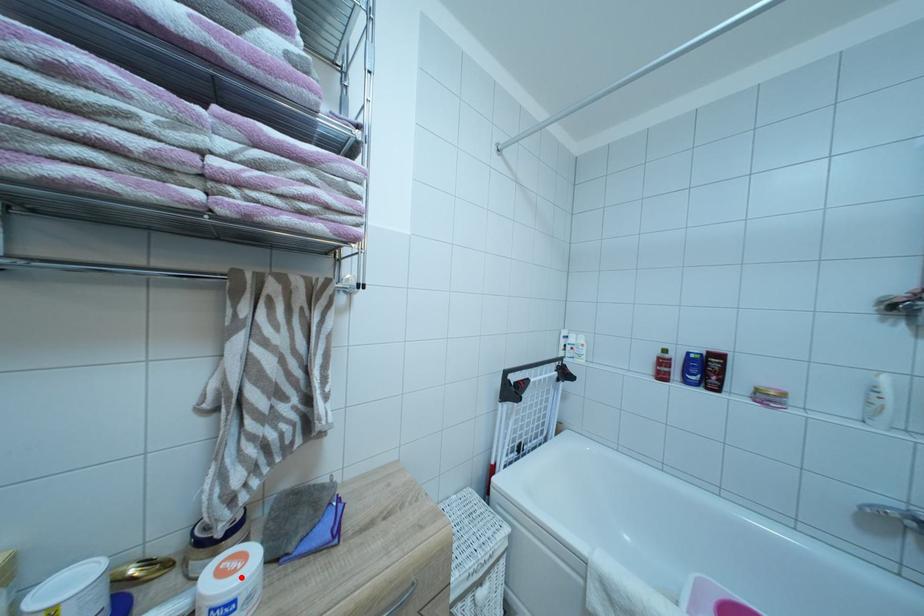
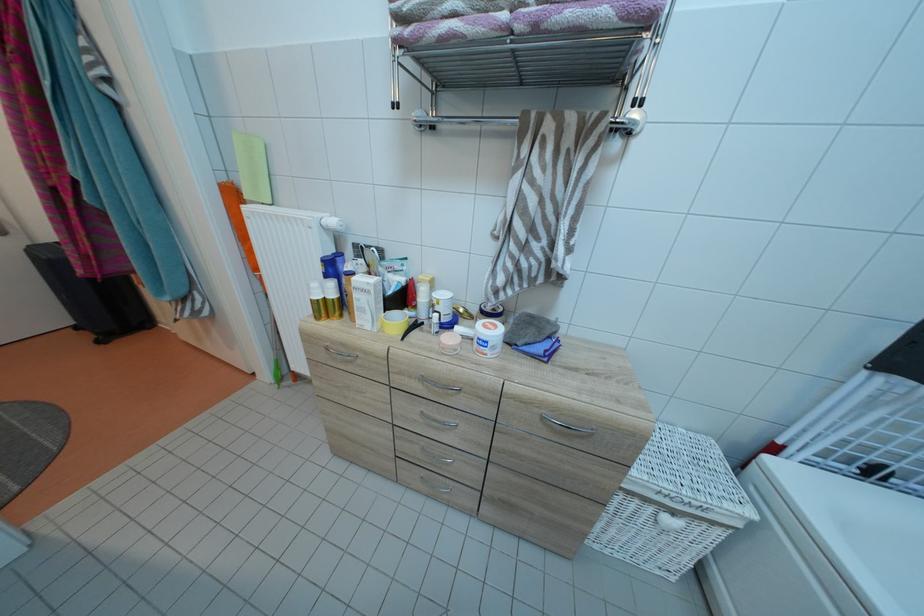
Locate, in the second image, the point that corresponds to the highlighted location in the first image.

(496, 334)